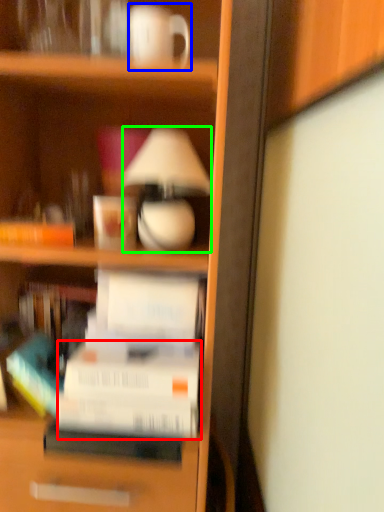
Question: Considering the real-world distances, which object is farthest from paperback book (highlighted by a red box)? coffee cup (highlighted by a blue box) or lamp (highlighted by a green box)?

Choices:
 (A) coffee cup
 (B) lamp

Answer: (A)